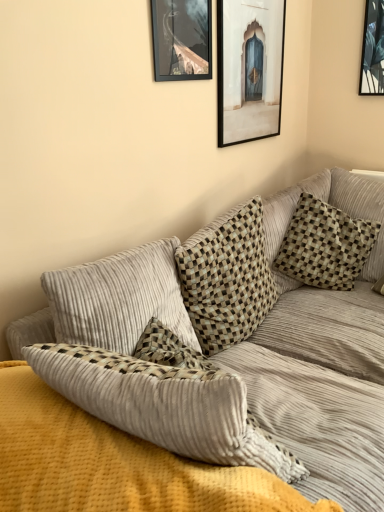
Question: Is checkered fabric pillow at center, which is the 2th pillow from right to left, completely or partially outside of checkered fabric pillow at upper right, the 1th pillow in the right-to-left sequence?

Choices:
 (A) no
 (B) yes

Answer: (B)

Question: Is checkered fabric pillow at center, the first pillow viewed from the left, placed right next to checkered fabric pillow at upper right, the 1th pillow in the right-to-left sequence?

Choices:
 (A) no
 (B) yes

Answer: (A)

Question: Does checkered fabric pillow at center, the first pillow viewed from the left, come in front of checkered fabric pillow at upper right, the 1th pillow in the right-to-left sequence?

Choices:
 (A) no
 (B) yes

Answer: (B)

Question: Can you confirm if checkered fabric pillow at center, which is the 2th pillow from right to left, is thinner than checkered fabric pillow at upper right, the 2th pillow positioned from the left?

Choices:
 (A) yes
 (B) no

Answer: (A)

Question: Considering the relative sizes of checkered fabric pillow at center, the first pillow viewed from the left, and checkered fabric pillow at upper right, the 1th pillow in the right-to-left sequence, in the image provided, is checkered fabric pillow at center, the first pillow viewed from the left, wider than checkered fabric pillow at upper right, the 1th pillow in the right-to-left sequence,?

Choices:
 (A) yes
 (B) no

Answer: (B)

Question: Considering the relative positions of checkered fabric pillow at center, the first pillow viewed from the left, and corduroy couch at center in the image provided, is checkered fabric pillow at center, the first pillow viewed from the left, to the left or to the right of corduroy couch at center?

Choices:
 (A) left
 (B) right

Answer: (B)

Question: Considering the positions of point (236, 324) and point (190, 426), is point (236, 324) closer or farther from the camera than point (190, 426)?

Choices:
 (A) closer
 (B) farther

Answer: (B)

Question: In terms of height, does checkered fabric pillow at center, which is the 2th pillow from right to left, look taller or shorter compared to corduroy couch at center?

Choices:
 (A) short
 (B) tall

Answer: (A)

Question: Is checkered fabric pillow at center, which is the 2th pillow from right to left, wider or thinner than corduroy couch at center?

Choices:
 (A) wide
 (B) thin

Answer: (B)

Question: Is point (235, 67) positioned closer to the camera than point (291, 253)?

Choices:
 (A) closer
 (B) farther

Answer: (A)

Question: Is matte wooden picture frame at upper center, which is counted as the 1th picture frame, starting from the back, bigger or smaller than checkered fabric pillow at upper right, the 2th pillow positioned from the left?

Choices:
 (A) small
 (B) big

Answer: (A)

Question: Looking at their shapes, would you say matte wooden picture frame at upper center, marked as the 1th picture frame in a right-to-left arrangement, is wider or thinner than checkered fabric pillow at upper right, the 2th pillow positioned from the left?

Choices:
 (A) wide
 (B) thin

Answer: (B)

Question: Which is correct: matte wooden picture frame at upper center, which ranks as the second picture frame in left-to-right order, is inside checkered fabric pillow at upper right, the 2th pillow positioned from the left, or outside of it?

Choices:
 (A) inside
 (B) outside

Answer: (B)

Question: Is matte black picture frame at upper center, positioned as the first picture frame in left-to-right order, wider or thinner than matte wooden picture frame at upper center, which ranks as the second picture frame in left-to-right order?

Choices:
 (A) wide
 (B) thin

Answer: (B)

Question: Relative to matte wooden picture frame at upper center, placed as the second picture frame when sorted from front to back, is matte black picture frame at upper center, positioned as the second picture frame in back-to-front order, in front or behind?

Choices:
 (A) front
 (B) behind

Answer: (A)